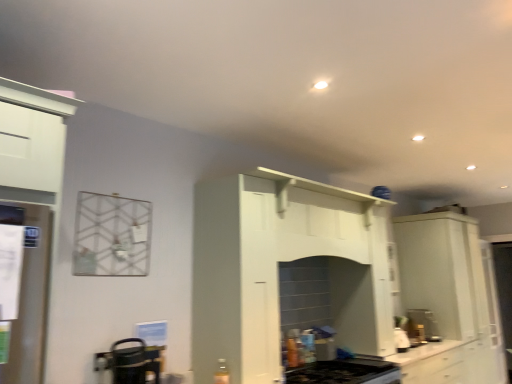
Question: Can you confirm if white glossy cabinet at right is shorter than white glossy countertop at lower center?

Choices:
 (A) no
 (B) yes

Answer: (A)

Question: Is white glossy cabinet at right aimed at white glossy countertop at lower center?

Choices:
 (A) no
 (B) yes

Answer: (A)

Question: Is white glossy cabinet at right at the right side of white glossy countertop at lower center?

Choices:
 (A) yes
 (B) no

Answer: (A)

Question: Can you see white glossy cabinet at right touching white glossy countertop at lower center?

Choices:
 (A) no
 (B) yes

Answer: (A)

Question: Can you confirm if white glossy cabinet at right is taller than white glossy countertop at lower center?

Choices:
 (A) no
 (B) yes

Answer: (B)

Question: From a real-world perspective, is white glossy cabinet at right over white glossy countertop at lower center?

Choices:
 (A) no
 (B) yes

Answer: (B)

Question: Is metallic silver kettle at lower left, which is counted as the second appliance, starting from the front, positioned behind black glass gas stove at lower center?

Choices:
 (A) yes
 (B) no

Answer: (B)

Question: Would you say black glass gas stove at lower center is part of metallic silver kettle at lower left, arranged as the second appliance when viewed from the top,'s contents?

Choices:
 (A) yes
 (B) no

Answer: (B)

Question: Is metallic silver kettle at lower left, positioned as the 1th appliance in right-to-left order, positioned before black glass gas stove at lower center?

Choices:
 (A) no
 (B) yes

Answer: (B)

Question: Are metallic silver kettle at lower left, positioned as the 1th appliance in right-to-left order, and black glass gas stove at lower center beside each other?

Choices:
 (A) no
 (B) yes

Answer: (A)

Question: Does metallic silver kettle at lower left, positioned as the 1th appliance in right-to-left order, have a smaller size compared to black glass gas stove at lower center?

Choices:
 (A) no
 (B) yes

Answer: (B)

Question: Is metallic silver kettle at lower left, positioned as the 1th appliance in right-to-left order, outside black glass gas stove at lower center?

Choices:
 (A) no
 (B) yes

Answer: (B)

Question: From the image's perspective, is white glossy cabinet at right on white glossy refrigerator at left, acting as the 1th appliance starting from the front?

Choices:
 (A) yes
 (B) no

Answer: (B)